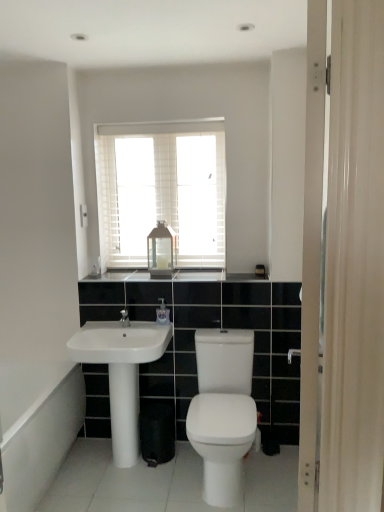
Question: Does white wooden blinds at upper center appear on the left side of white glossy pillar at center?

Choices:
 (A) yes
 (B) no

Answer: (B)

Question: From the image's perspective, would you say white wooden blinds at upper center is positioned over white glossy pillar at center?

Choices:
 (A) yes
 (B) no

Answer: (A)

Question: Is white glossy pillar at center completely or partially inside white wooden blinds at upper center?

Choices:
 (A) yes
 (B) no

Answer: (B)

Question: Can you confirm if white wooden blinds at upper center is taller than white glossy pillar at center?

Choices:
 (A) yes
 (B) no

Answer: (A)

Question: Considering the relative sizes of white wooden blinds at upper center and white glossy pillar at center in the image provided, is white wooden blinds at upper center wider than white glossy pillar at center?

Choices:
 (A) yes
 (B) no

Answer: (B)

Question: Is point (132, 362) positioned closer to the camera than point (152, 266)?

Choices:
 (A) closer
 (B) farther

Answer: (A)

Question: From a real-world perspective, relative to matte glass lantern at center, is white glossy sink at lower left vertically above or below?

Choices:
 (A) below
 (B) above

Answer: (A)

Question: Choose the correct answer: Is white glossy sink at lower left inside matte glass lantern at center or outside it?

Choices:
 (A) outside
 (B) inside

Answer: (A)

Question: From the image's perspective, is white glossy sink at lower left positioned above or below matte glass lantern at center?

Choices:
 (A) above
 (B) below

Answer: (B)

Question: Is white glossy pillar at center to the left or to the right of white glossy sink at lower left in the image?

Choices:
 (A) right
 (B) left

Answer: (A)

Question: Considering the positions of white glossy pillar at center and white glossy sink at lower left in the image, is white glossy pillar at center wider or thinner than white glossy sink at lower left?

Choices:
 (A) wide
 (B) thin

Answer: (B)

Question: Choose the correct answer: Is white glossy pillar at center inside white glossy sink at lower left or outside it?

Choices:
 (A) inside
 (B) outside

Answer: (B)

Question: From a real-world perspective, relative to white glossy sink at lower left, is white glossy pillar at center vertically above or below?

Choices:
 (A) above
 (B) below

Answer: (B)

Question: Is clear plastic soap dispenser at center inside the boundaries of matte glass lantern at center, or outside?

Choices:
 (A) inside
 (B) outside

Answer: (B)

Question: Based on their positions, is clear plastic soap dispenser at center located to the left or right of matte glass lantern at center?

Choices:
 (A) right
 (B) left

Answer: (A)